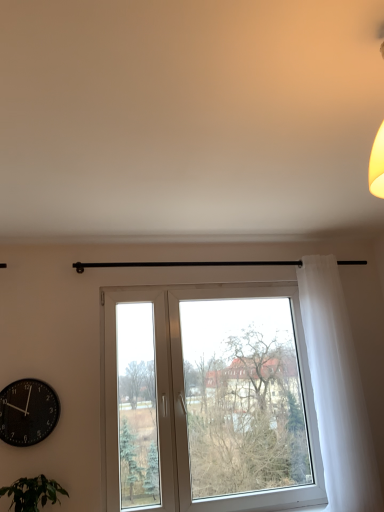
Question: From a real-world perspective, is black matte wall clock at lower left physically above green leafy plant at lower left?

Choices:
 (A) yes
 (B) no

Answer: (A)

Question: Does black matte wall clock at lower left appear on the left side of green leafy plant at lower left?

Choices:
 (A) yes
 (B) no

Answer: (A)

Question: From the image's perspective, does black matte wall clock at lower left appear lower than green leafy plant at lower left?

Choices:
 (A) no
 (B) yes

Answer: (A)

Question: From a real-world perspective, is black matte wall clock at lower left below green leafy plant at lower left?

Choices:
 (A) yes
 (B) no

Answer: (B)

Question: From the image's perspective, is black matte wall clock at lower left on green leafy plant at lower left?

Choices:
 (A) yes
 (B) no

Answer: (A)

Question: Would you say black matte wall clock at lower left is outside green leafy plant at lower left?

Choices:
 (A) yes
 (B) no

Answer: (A)

Question: From a real-world perspective, is white sheer curtain at right located higher than white plastic window at center?

Choices:
 (A) yes
 (B) no

Answer: (A)

Question: Can you confirm if white sheer curtain at right is positioned to the left of white plastic window at center?

Choices:
 (A) no
 (B) yes

Answer: (A)

Question: Does white sheer curtain at right have a smaller size compared to white plastic window at center?

Choices:
 (A) yes
 (B) no

Answer: (A)

Question: From a real-world perspective, does white sheer curtain at right sit lower than white plastic window at center?

Choices:
 (A) no
 (B) yes

Answer: (A)

Question: From the image's perspective, is white sheer curtain at right above white plastic window at center?

Choices:
 (A) no
 (B) yes

Answer: (B)

Question: Is the depth of white sheer curtain at right less than that of white plastic window at center?

Choices:
 (A) yes
 (B) no

Answer: (B)

Question: Does white plastic window at center have a greater width compared to white sheer curtain at right?

Choices:
 (A) no
 (B) yes

Answer: (A)